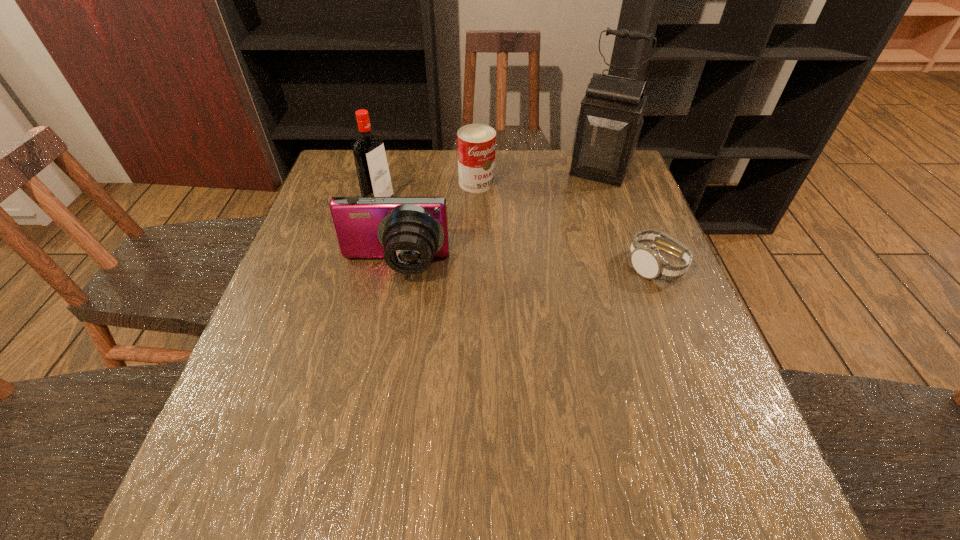
This screenshot has width=960, height=540. I want to click on free spot on the desktop that is between the camera and the shortest object and is positioned on the front-facing side of the tallest object, so click(x=554, y=267).

Locate an element on the screen. This screenshot has height=540, width=960. free space on the desktop that is between the camera and the shortest object and is positioned on the front and back of the vodka is located at coordinates (527, 267).

The height and width of the screenshot is (540, 960). I want to click on free space on the desktop that is between the camera and the shortest object and is positioned on the front label of the third object from right to left, so click(x=552, y=267).